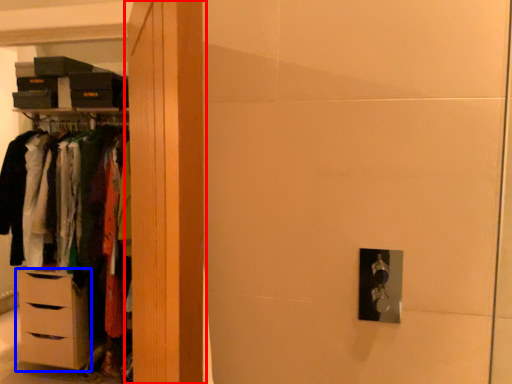
Question: Among these objects, which one is nearest to the camera, armoire (highlighted by a red box) or chest of drawers (highlighted by a blue box)?

Choices:
 (A) armoire
 (B) chest of drawers

Answer: (A)